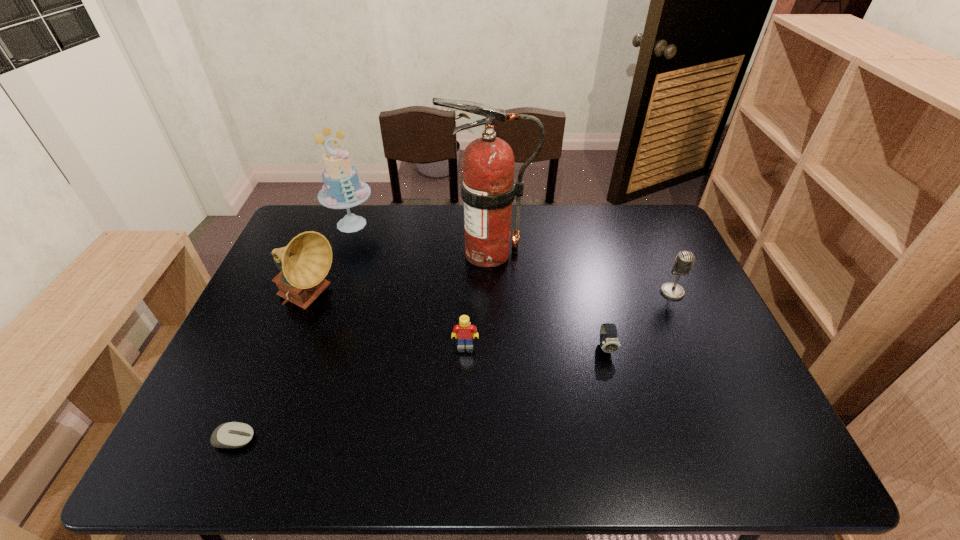
Locate an element on the screen. blank space that satisfies the following two spatial constraints: 1. on the back side of the rightmost object; 2. at the nozzle of the fire extinguisher is located at coordinates (655, 253).

This screenshot has width=960, height=540. I want to click on vacant space that satisfies the following two spatial constraints: 1. with a ladder on the side of the cake; 2. on the wheel side of the nearest object, so click(275, 439).